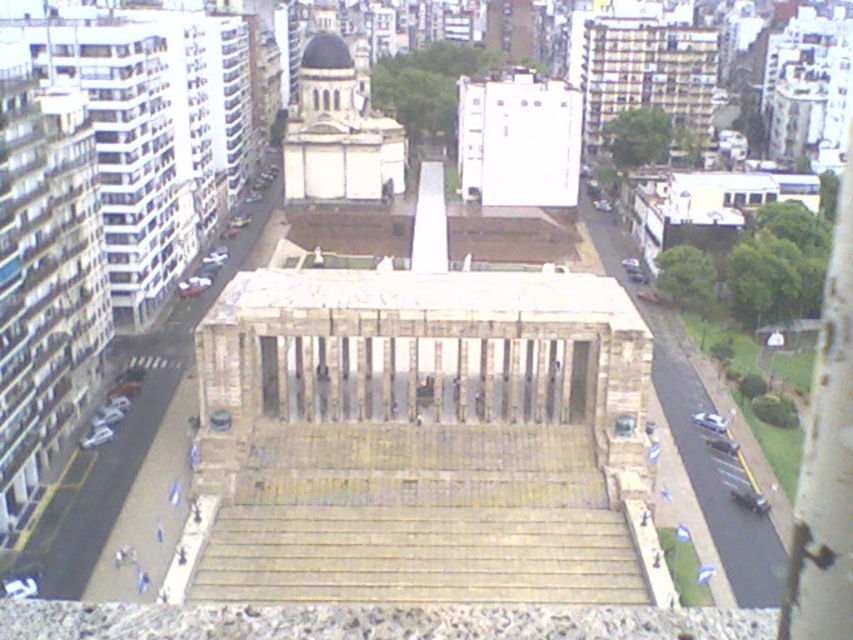
You are standing at the monument entrance and see the point marked at coordinates (x=827, y=460). What object is located at that point?

The point at coordinates (x=827, y=460) marks the location of the smooth white pillar at right.

Based on the scene provided, which object has a greater width between the smooth white pillar at right and the smooth dark blue dome at upper center?

The smooth white pillar at right is wider than the smooth dark blue dome at upper center according to the description.

You are a photographer standing at the base of the monument. You want to capture both the smooth white pillar at right and the smooth dark blue dome at upper center in the same frame. Which object should you position closer to the camera to ensure both are visible?

You should position the smooth white pillar at right closer to the camera because it is in front of the smooth dark blue dome at upper center, ensuring both can be captured in the same frame.